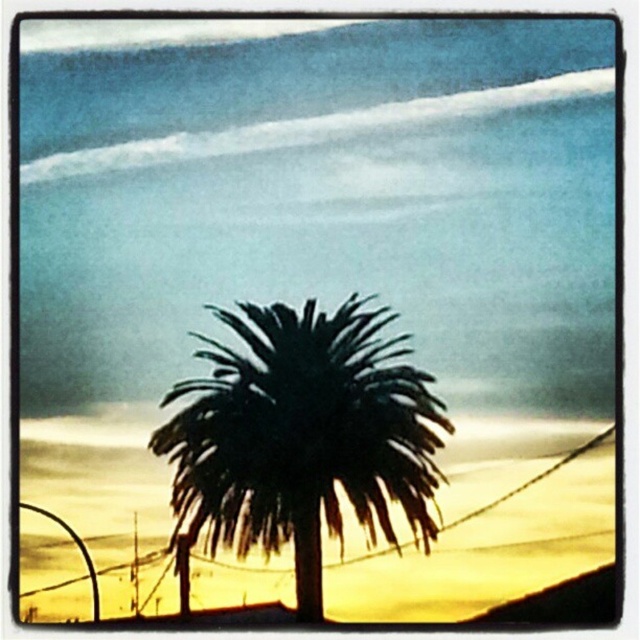
You are an artist setting up your easel to paint the coastal scene. You notice the black wire at center and the dark green leafy palm tree at center. Which object should you focus on first if you want to paint the larger one?

The black wire at center has a larger size compared to the dark green leafy palm tree at center, so you should focus on painting the black wire at center first.

You are an artist trying to sketch the scene. You notice the black wire at center and the dark green leafy palm tree at center. Which object should you draw first if you want to follow the rule of drawing background elements before foreground elements?

The dark green leafy palm tree at center should be drawn first because it is the foreground element, but since the rule is to draw background before foreground, you should actually start with the background. However, according to the description, the palm tree is in the foreground, so the black wire at center is not as tall, but the question is about background vs foreground. Wait, the scene says the palm tree is in the foreground. The black wire is at center, but the palm tree is also at center. Hmm, need

You are standing at the beach looking at the palm tree and the ocean. There are two points marked in the scene. One is at coordinates point (44, 596) and the other at point (384, 388). Which point is closer to you?

Point (44, 596) is closer to you because it is further to the camera than point (384, 388).